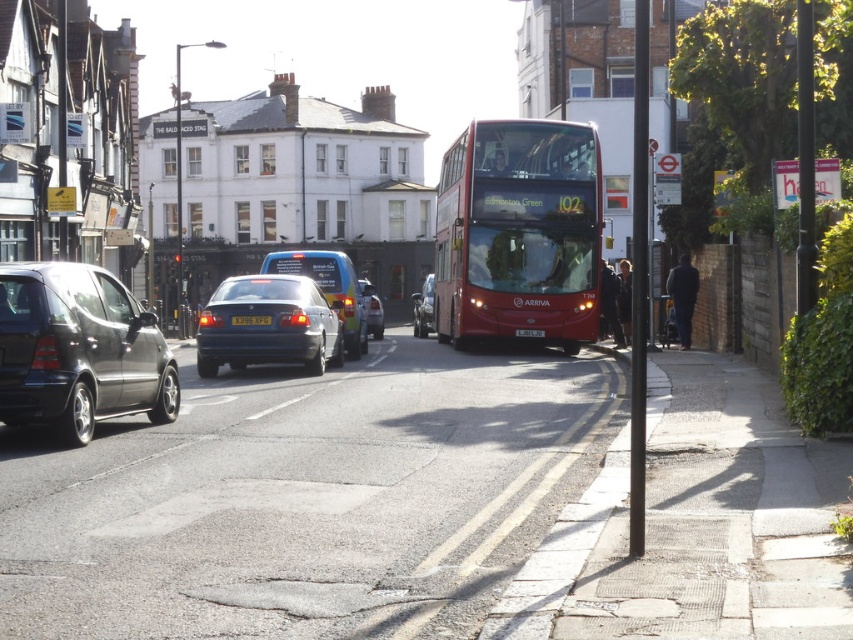
You are a pedestrian standing at the edge of the road where the double decker bus is parked. You need to cross the road to reach a store across. There is a matte black hatchback at left and a yellow matte license plate at center. Which object is closer to the road surface?

The matte black hatchback at left is located below the yellow matte license plate at center, so the matte black hatchback at left is closer to the road surface.

You are a delivery person trying to decide which vehicle to park behind to avoid blocking the sun from the driver behind you. The matte black hatchback at left and the matte black sedan at center are both parked along the curb. Which vehicle should you choose to park behind?

You should park behind the matte black sedan at center because it is taller than the matte black hatchback at left, providing better shade from the sun.

You are a pedestrian standing at the curb next to the matte black hatchback at left and want to cross the street to reach the blue metallic van at center. The road is 12 meters wide. Can you safely cross the road before the double decker bus passes by?

The matte black hatchback at left is 9.76 meters away from the blue metallic van at center, so the distance you need to cross is 9.76 meters. Since the road is 12 meters wide, you have enough space to cross safely before the double decker bus passes by.